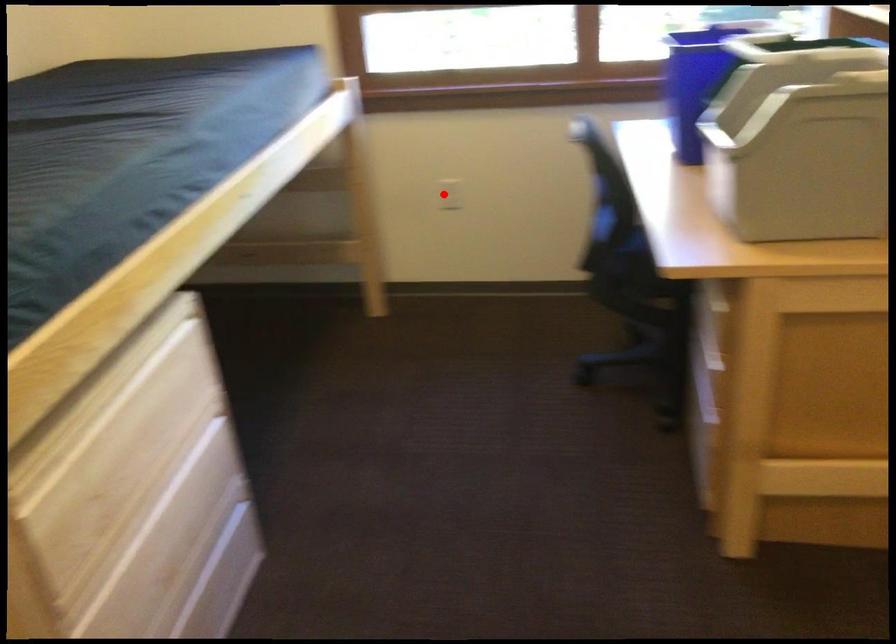
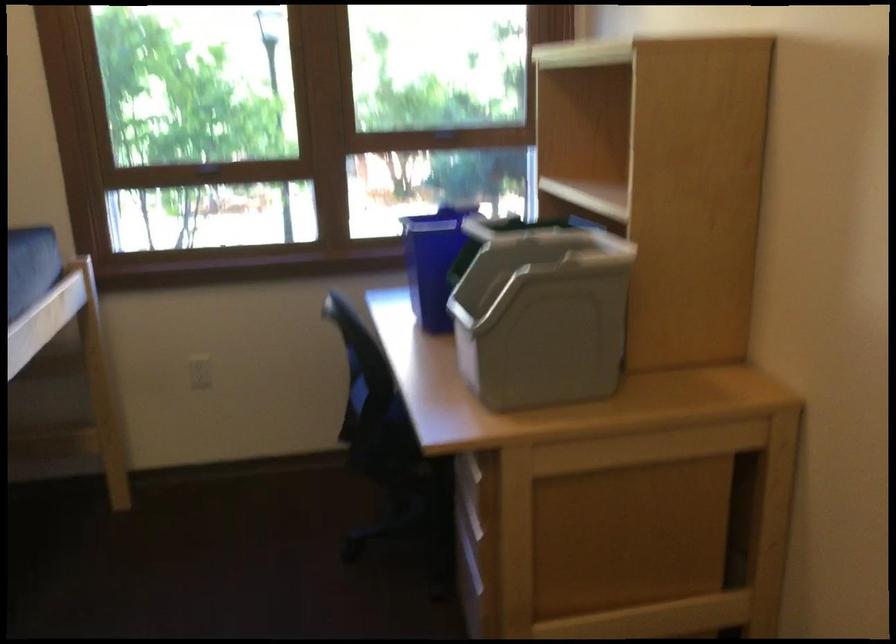
Where in the second image is the point corresponding to the highlighted location from the first image?

(200, 372)